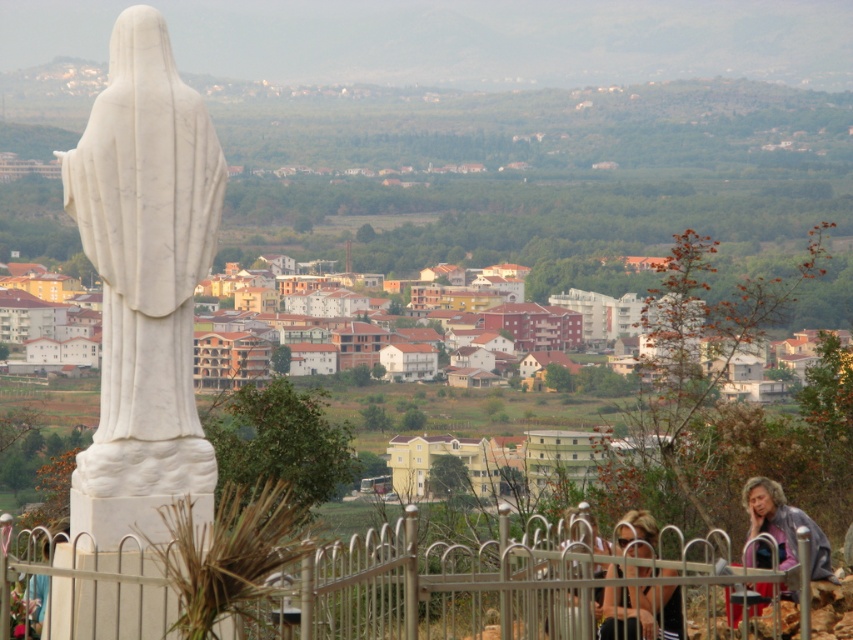
Is black fabric dress at lower right below gray fabric jacket at lower right?

No, black fabric dress at lower right is not below gray fabric jacket at lower right.

Does black fabric dress at lower right appear on the right side of gray fabric jacket at lower right?

In fact, black fabric dress at lower right is to the left of gray fabric jacket at lower right.

You are a GUI agent. You are given a task and a screenshot of the screen. Output one action in this format:
    pyautogui.click(x=<x>, y=<y>)
    Task: Click on the black fabric dress at lower right
    Image resolution: width=853 pixels, height=640 pixels.
    Given the screenshot: What is the action you would take?
    pyautogui.click(x=640, y=612)

Who is shorter, metallic silver fence at lower center or black fabric dress at lower right?

black fabric dress at lower right is shorter.

Is metallic silver fence at lower center thinner than black fabric dress at lower right?

Incorrect, metallic silver fence at lower center's width is not less than black fabric dress at lower right's.

Who is more forward, (x=569, y=618) or (x=647, y=525)?

Positioned in front is point (x=569, y=618).

Locate an element on the screen. The height and width of the screenshot is (640, 853). metallic silver fence at lower center is located at coordinates (405, 586).

Is metallic silver fence at lower center below gray fabric jacket at lower right?

Correct, metallic silver fence at lower center is located below gray fabric jacket at lower right.

Who is lower down, metallic silver fence at lower center or gray fabric jacket at lower right?

metallic silver fence at lower center is lower down.

The height and width of the screenshot is (640, 853). Find the location of `metallic silver fence at lower center`. metallic silver fence at lower center is located at coordinates (405, 586).